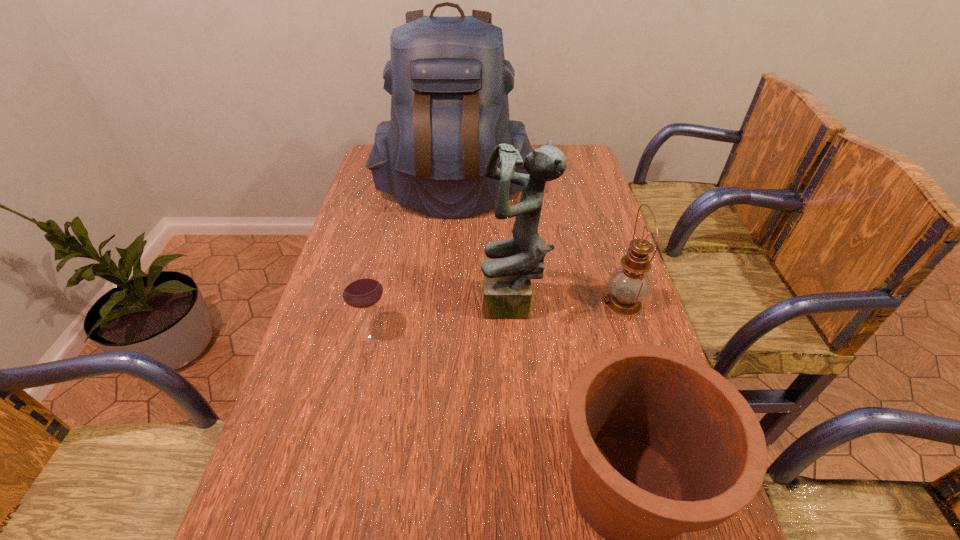
The height and width of the screenshot is (540, 960). What are the coordinates of `the tallest object` in the screenshot? It's located at (448, 79).

Locate an element on the screen. Image resolution: width=960 pixels, height=540 pixels. backpack is located at coordinates (448, 79).

Locate an element on the screen. the fourth shortest object is located at coordinates (507, 293).

The height and width of the screenshot is (540, 960). Find the location of `oil lamp`. oil lamp is located at coordinates (629, 284).

At what (x,y) coordinates should I click in order to perform the action: click on the shortest object. Please return your answer as a coordinate pair (x, y). Looking at the image, I should click on (361, 289).

Where is `blank area located at the front pocket of the backpack`? Image resolution: width=960 pixels, height=540 pixels. blank area located at the front pocket of the backpack is located at coordinates (448, 255).

Locate an element on the screen. The width and height of the screenshot is (960, 540). vacant area situated 0.130m on the face of the sculpture is located at coordinates (431, 307).

You are a GUI agent. You are given a task and a screenshot of the screen. Output one action in this format:
    pyautogui.click(x=<x>, y=<y>)
    Task: Click on the free space located 0.070m on the face of the sculpture
    
    Given the screenshot: What is the action you would take?
    pyautogui.click(x=454, y=307)

The image size is (960, 540). Find the location of `vacant space located 0.170m on the face of the sculpture`. vacant space located 0.170m on the face of the sculpture is located at coordinates (416, 307).

The height and width of the screenshot is (540, 960). Identify the location of vacant space located 0.060m on the front of the oil lamp. (636, 344).